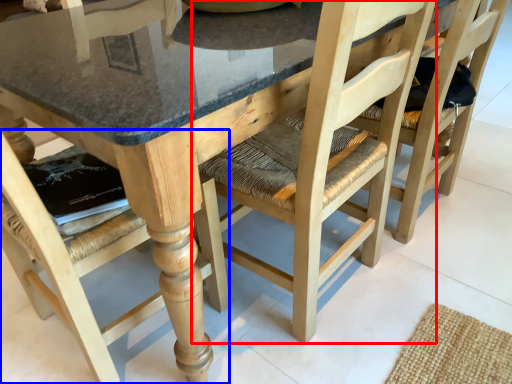
Question: Which point is further to the camera, chair (highlighted by a red box) or chair (highlighted by a blue box)?

Choices:
 (A) chair
 (B) chair

Answer: (A)